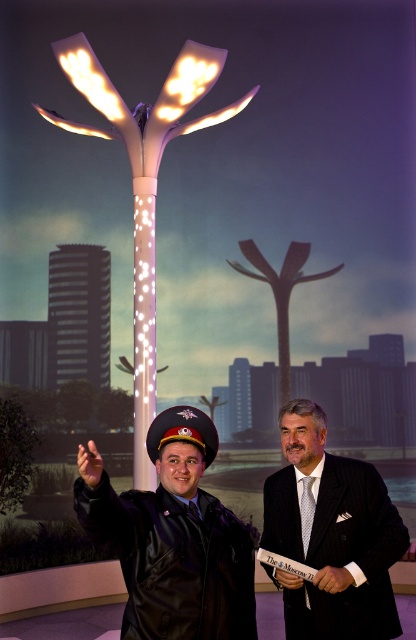
You are a pedestrian standing on the street in the image. You see two points marked on the ground ahead of you. The first point is at coordinates point (317, 548) and the second is at point (286, 579). Which point is closer to you?

Point (317, 548) is closer to you because it is further to the viewer than point (286, 579).

You are a delivery robot with a 2 meter wide package. You need to move from the transparent glass pole at center to the shiny black uniform at center. Is there enough space between them for your package?

The transparent glass pole at center is 8.22 meters away from the shiny black uniform at center. Since your package is 2 meters wide, there is sufficient space between them for your delivery.